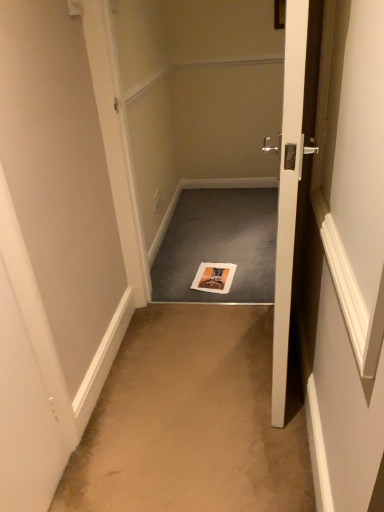
Question: From a real-world perspective, is orange matte magazine at center physically located above or below beige carpet at center?

Choices:
 (A) above
 (B) below

Answer: (A)

Question: Is orange matte magazine at center spatially inside beige carpet at center, or outside of it?

Choices:
 (A) inside
 (B) outside

Answer: (B)

Question: Estimate the real-world distances between objects in this image. Which object is closer to the gray carpet at center?

Choices:
 (A) orange matte magazine at center
 (B) white glossy door at center
 (C) beige carpet at center

Answer: (A)

Question: Which object is positioned closest to the white glossy door at center?

Choices:
 (A) beige carpet at center
 (B) orange matte magazine at center
 (C) gray carpet at center

Answer: (A)